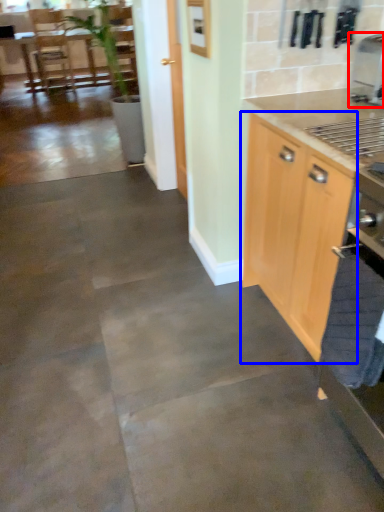
Question: Which object appears farthest to the camera in this image, coffee machine (highlighted by a red box) or cabinetry (highlighted by a blue box)?

Choices:
 (A) coffee machine
 (B) cabinetry

Answer: (A)